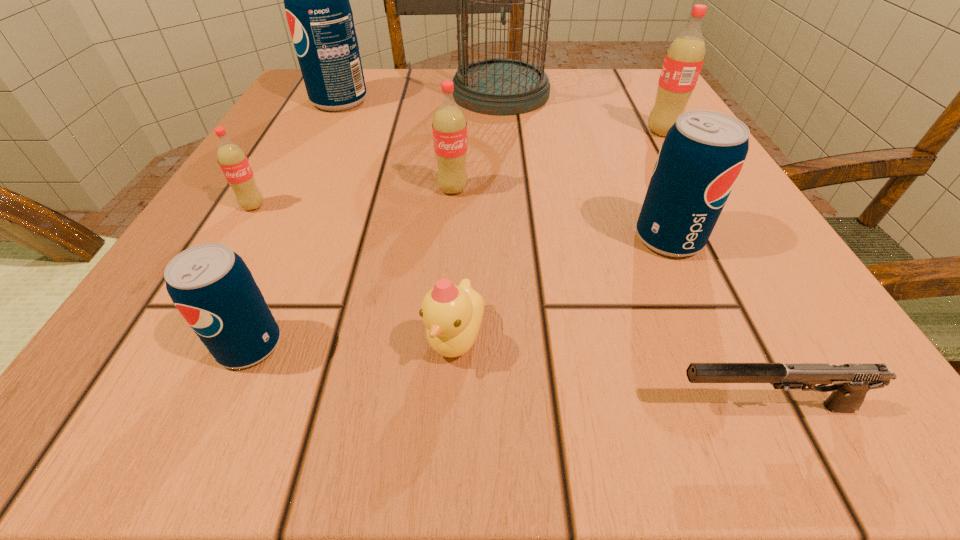
At what (x,y) coordinates should I click in order to perform the action: click on free space located on the front of the biggest blue pop. Please return your answer as a coordinate pair (x, y). Looking at the image, I should click on (318, 144).

You are a GUI agent. You are given a task and a screenshot of the screen. Output one action in this format:
    pyautogui.click(x=<x>, y=<y>)
    Task: Click on the vacant space located on the front of the rightmost red soda
    The width and height of the screenshot is (960, 540).
    Given the screenshot: What is the action you would take?
    pyautogui.click(x=729, y=247)

The image size is (960, 540). Find the location of `vacant space located on the right of the second farthest red soda`. vacant space located on the right of the second farthest red soda is located at coordinates pyautogui.click(x=673, y=189).

Locate an element on the screen. This screenshot has width=960, height=540. free space located on the right of the second smallest blue pop is located at coordinates [x=764, y=238].

Find the location of a particular element. Image resolution: width=960 pixels, height=540 pixels. blank area located on the right of the smallest blue pop is located at coordinates (358, 345).

The height and width of the screenshot is (540, 960). I want to click on free space located on the front of the fifth nearest object, so click(204, 288).

Identify the location of free region located 0.100m at the muzzle end of the shortest object. (563, 407).

The image size is (960, 540). Find the location of `vacant space situated 0.360m at the muzzle end of the shortest object`. vacant space situated 0.360m at the muzzle end of the shortest object is located at coordinates (281, 407).

At what (x,y) coordinates should I click in order to perform the action: click on free point located 0.300m at the muzzle end of the shortest object. Please return your answer as a coordinate pair (x, y). Image resolution: width=960 pixels, height=540 pixels. Looking at the image, I should click on (346, 407).

The width and height of the screenshot is (960, 540). In order to click on birdcage situated at the far edge in this screenshot , I will do `click(499, 86)`.